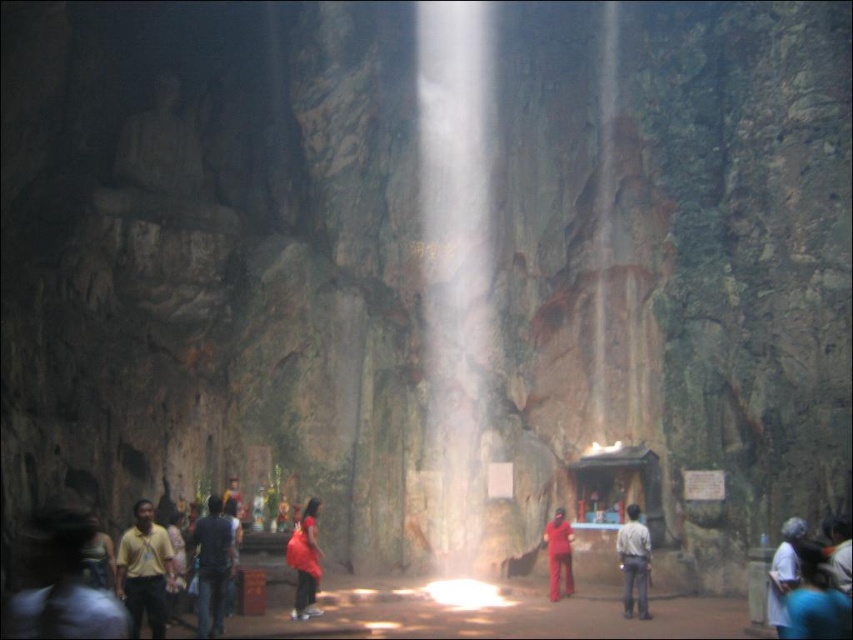
The image size is (853, 640). In order to click on yellow shirt at lower left in this screenshot , I will do `click(144, 570)`.

Who is more forward, [170,577] or [310,573]?

Point [170,577]

Image resolution: width=853 pixels, height=640 pixels. Identify the location of yellow shirt at lower left. (144, 570).

Find the location of `yellow shirt at lower left`. yellow shirt at lower left is located at coordinates (144, 570).

Between white matte shirt at lower right and matte red pants at center, which one is positioned lower?

matte red pants at center

Between white matte shirt at lower right and matte red pants at center, which one has more height?

Standing taller between the two is matte red pants at center.

This screenshot has height=640, width=853. Find the location of `white matte shirt at lower right`. white matte shirt at lower right is located at coordinates 782,572.

How distant is yellow shirt at lower left from white matte shirt at lower right?

The distance of yellow shirt at lower left from white matte shirt at lower right is 25.73 meters.

Consider the image. Does yellow shirt at lower left have a smaller size compared to white matte shirt at lower right?

No, yellow shirt at lower left is not smaller than white matte shirt at lower right.

Is point (155, 560) closer to viewer compared to point (795, 556)?

That is False.

Find the location of a particular element. yellow shirt at lower left is located at coordinates (144, 570).